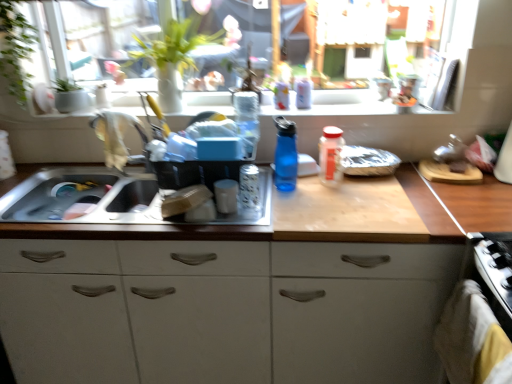
Find the location of `vacant space situated above matte white window sill at upper center (from a real-world perspective)`. vacant space situated above matte white window sill at upper center (from a real-world perspective) is located at coordinates (273, 107).